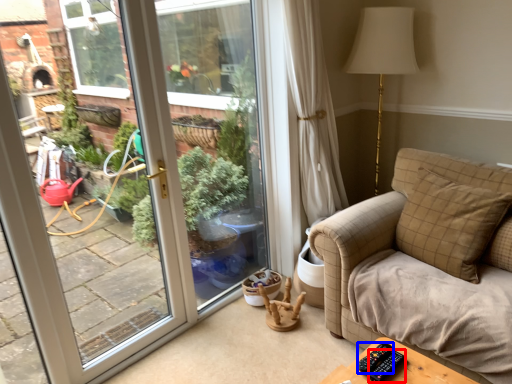
Question: Which object appears closest to the camera in this image, remote (highlighted by a red box) or remote (highlighted by a blue box)?

Choices:
 (A) remote
 (B) remote

Answer: (A)